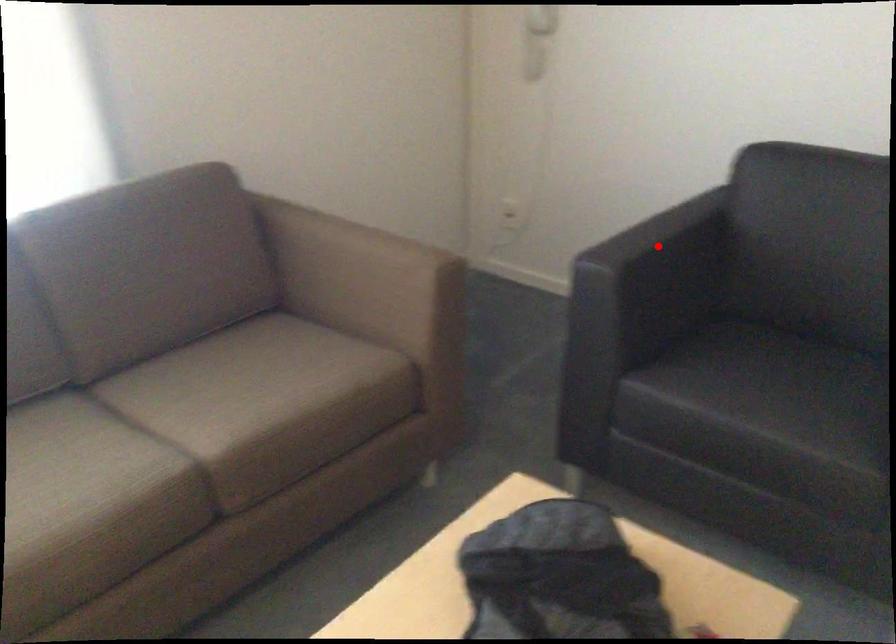
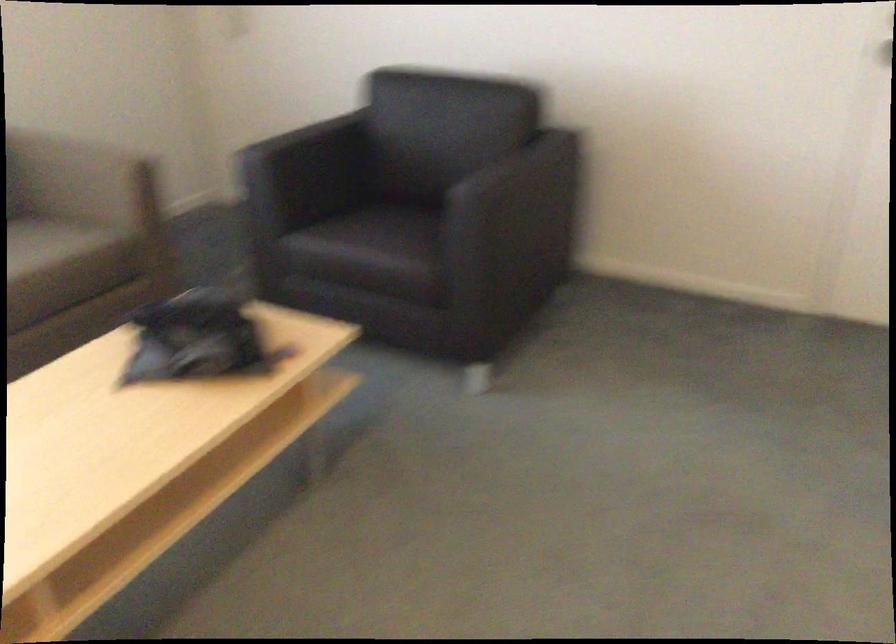
The point at the highlighted location is marked in the first image. Where is the corresponding point in the second image?

(304, 138)